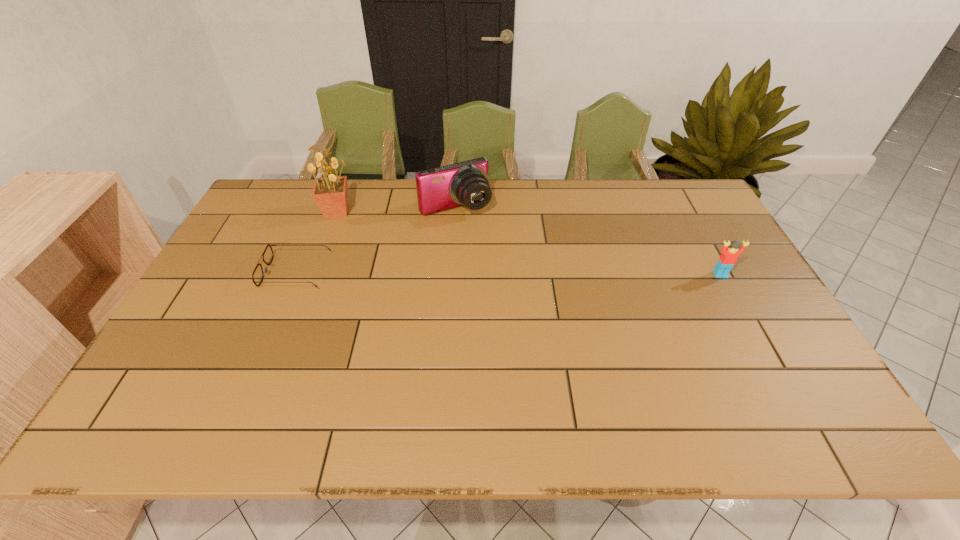
The height and width of the screenshot is (540, 960). Find the location of `empty space that is in between the Lego and the sunflower`. empty space that is in between the Lego and the sunflower is located at coordinates (529, 243).

You are a GUI agent. You are given a task and a screenshot of the screen. Output one action in this format:
    pyautogui.click(x=<x>, y=<y>)
    Task: Click on the vacant area between the sunglasses and the second object from right to left
    The width and height of the screenshot is (960, 540).
    Given the screenshot: What is the action you would take?
    pyautogui.click(x=375, y=240)

The height and width of the screenshot is (540, 960). In order to click on free spot between the tallest object and the rightmost object in this screenshot , I will do `click(529, 243)`.

This screenshot has width=960, height=540. I want to click on unoccupied area between the sunglasses and the sunflower, so click(x=317, y=242).

Point out which object is positioned as the third nearest to the tallest object. Please provide its 2D coordinates. Your answer should be formatted as a tuple, i.e. [(x, y)], where the tuple contains the x and y coordinates of a point satisfying the conditions above.

[(728, 258)]

The width and height of the screenshot is (960, 540). Find the location of `the third closest object to the sunglasses`. the third closest object to the sunglasses is located at coordinates (728, 258).